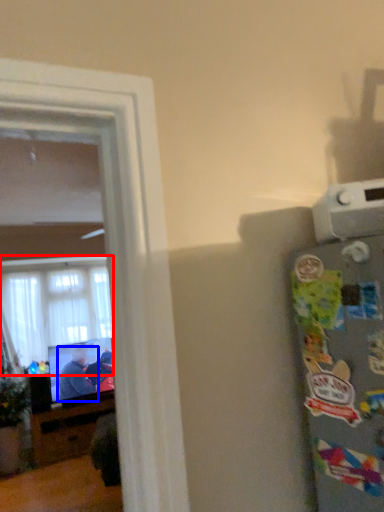
Question: Which point is further to the camera, window (highlighted by a red box) or person (highlighted by a blue box)?

Choices:
 (A) window
 (B) person

Answer: (A)